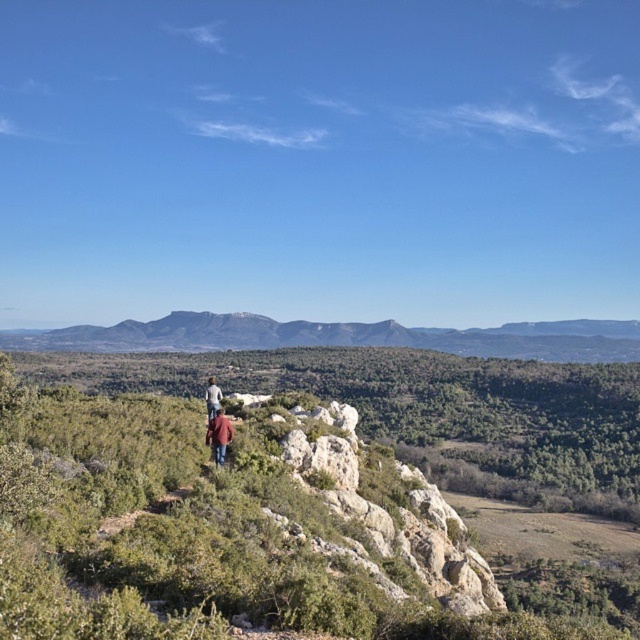
Based on the scene description, where is the green shrubbery at center located in terms of coordinates?

The green shrubbery at center is located at coordinates point (x=269, y=508).